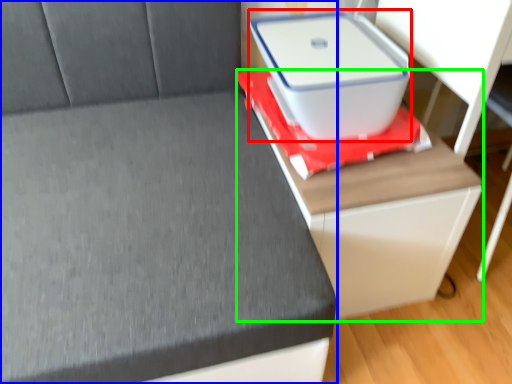
Question: Which is nearer to the storage box (highlighted by a red box)? furniture (highlighted by a blue box) or table (highlighted by a green box).

Choices:
 (A) furniture
 (B) table

Answer: (B)